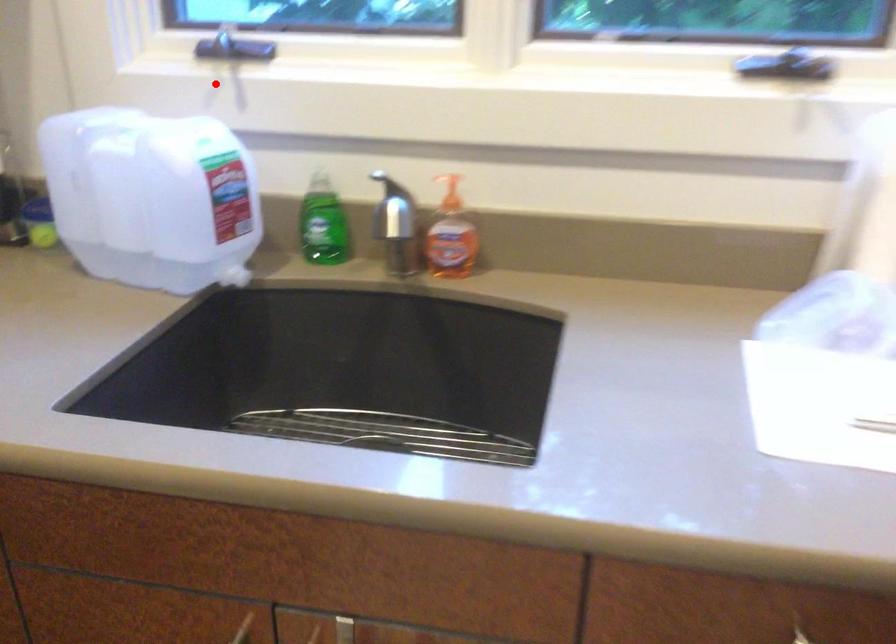
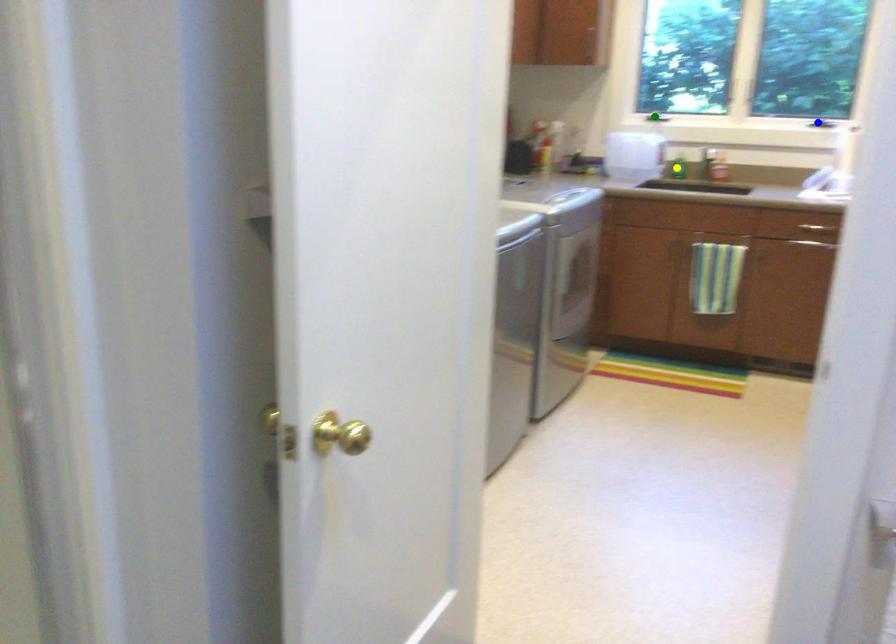
Question: I am providing you with two images of the same scene from different viewpoints. A red point is marked on the first image. You are given multiple points on the second image. Which spot in image 2 lines up with the point in image 1?

Choices:
 (A) green point
 (B) blue point
 (C) yellow point

Answer: (A)